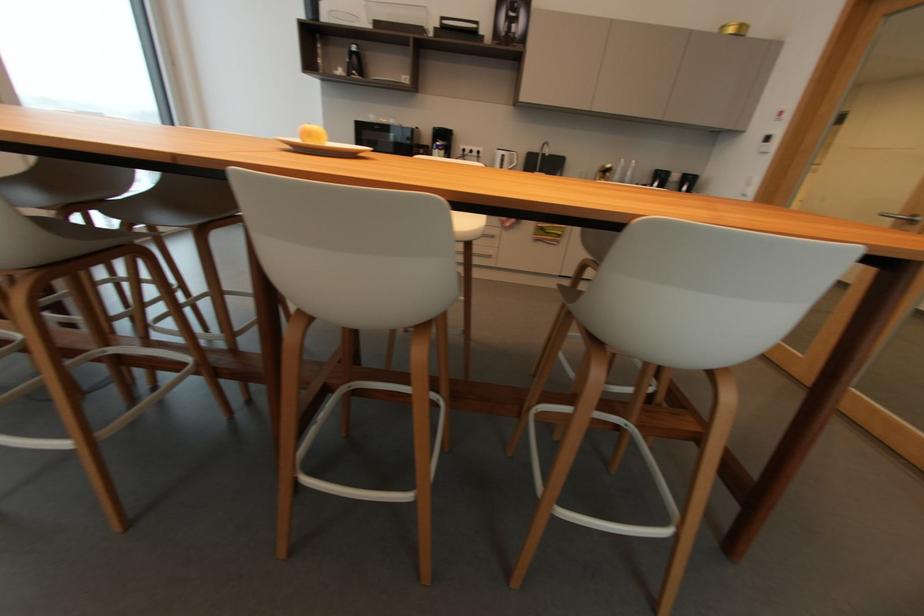
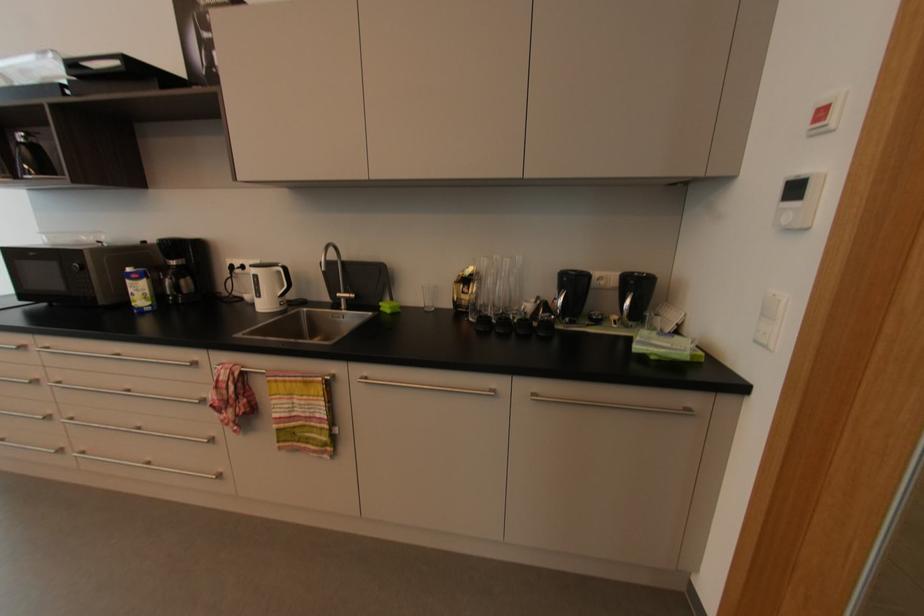
Where in the second image is the point corresponding to (441,144) from the first image?

(131, 270)